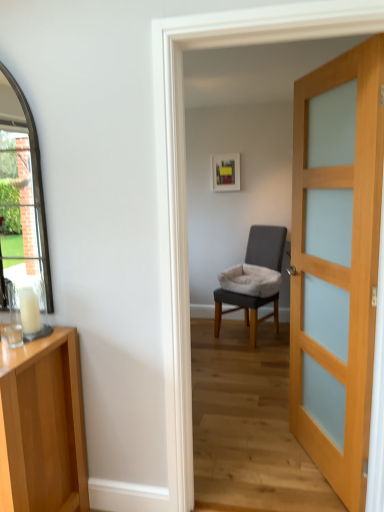
Locate an element on the screen. The image size is (384, 512). free point in front of gray fabric chair at center is located at coordinates (250, 357).